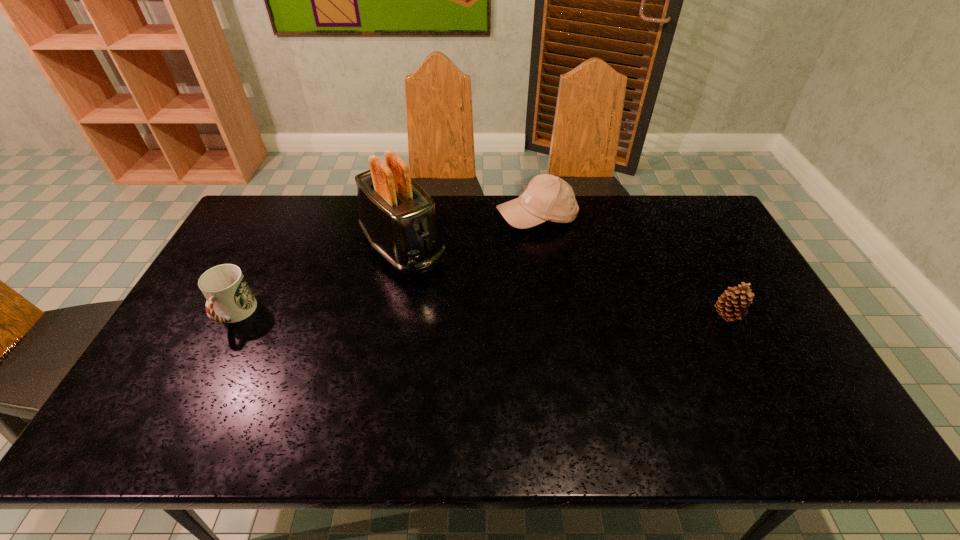
Where is `free spot on the desktop that is between the cup and the pinecone and is positioned on the side of the third object from right to left with the control lever`? The width and height of the screenshot is (960, 540). free spot on the desktop that is between the cup and the pinecone and is positioned on the side of the third object from right to left with the control lever is located at coordinates (464, 315).

This screenshot has width=960, height=540. What are the coordinates of `free space on the desktop that is between the leftmost object and the rightmost object and is positioned on the front-facing side of the second tallest object` in the screenshot? It's located at (516, 315).